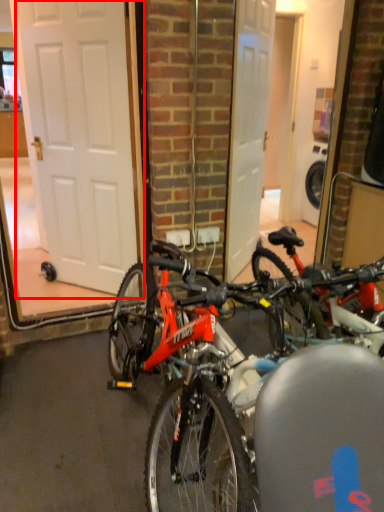
Question: In this image, where is door (annotated by the red box) located relative to bicycle?

Choices:
 (A) left
 (B) right

Answer: (A)